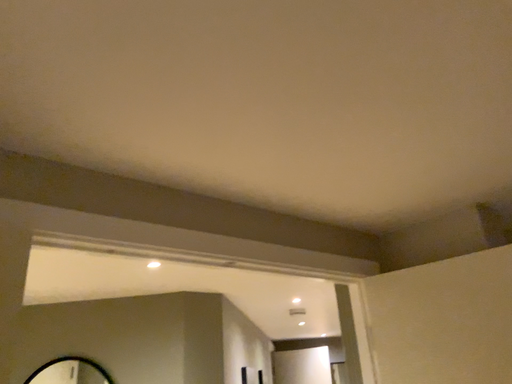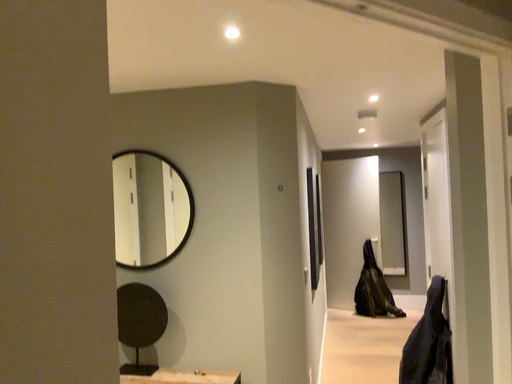
Question: Which way did the camera rotate in the video?

Choices:
 (A) rotated upward
 (B) rotated downward

Answer: (B)